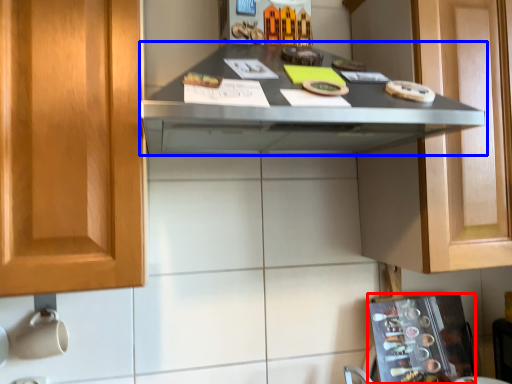
Question: Which point is closer to the camera, appliance (highlighted by a red box) or countertop (highlighted by a blue box)?

Choices:
 (A) appliance
 (B) countertop

Answer: (B)